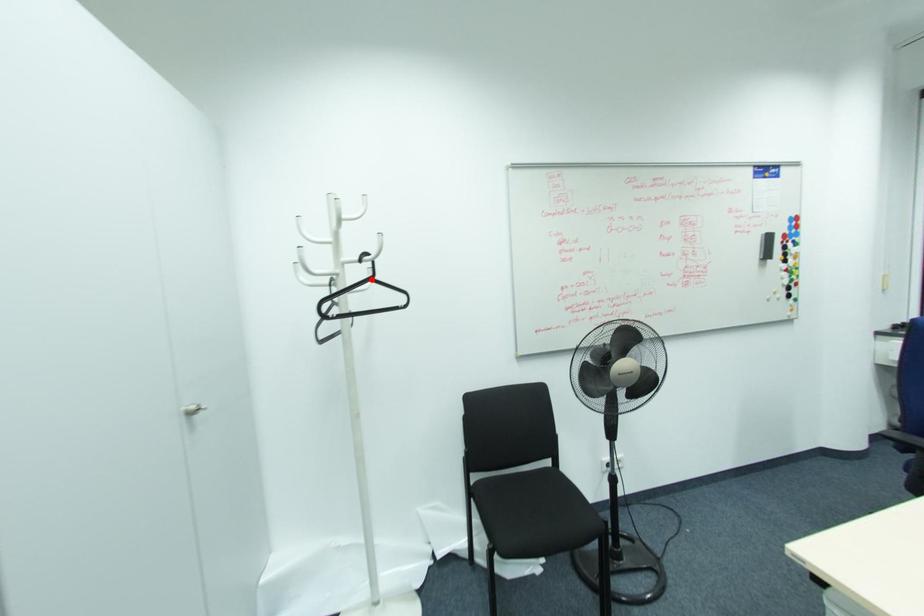
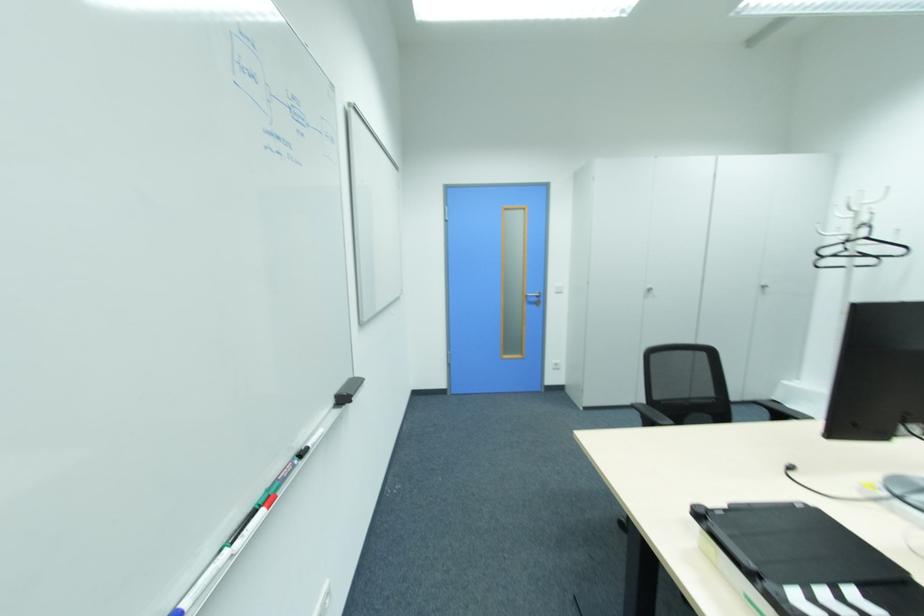
Find the pixel in the second image that matches the highlighted location in the first image.

(865, 238)